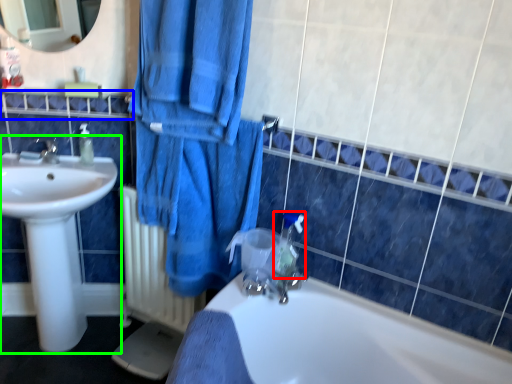
Question: Which object is positioned farthest from plumbing fixture (highlighted by a red box)? Select from balustrade (highlighted by a blue box) and sink (highlighted by a green box).

Choices:
 (A) balustrade
 (B) sink

Answer: (A)